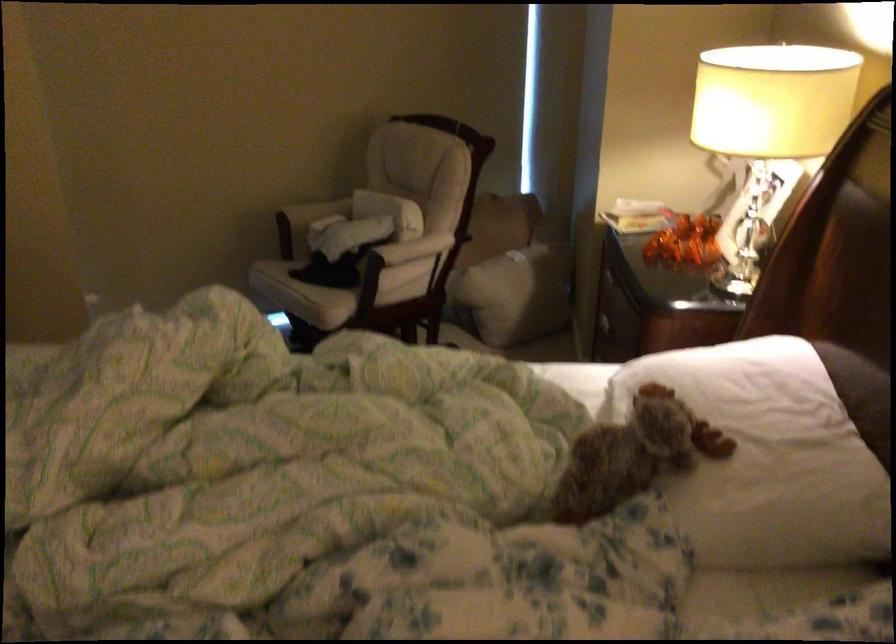
Find the location of a particular element. The width and height of the screenshot is (896, 644). white chair sitting surface is located at coordinates (291, 285).